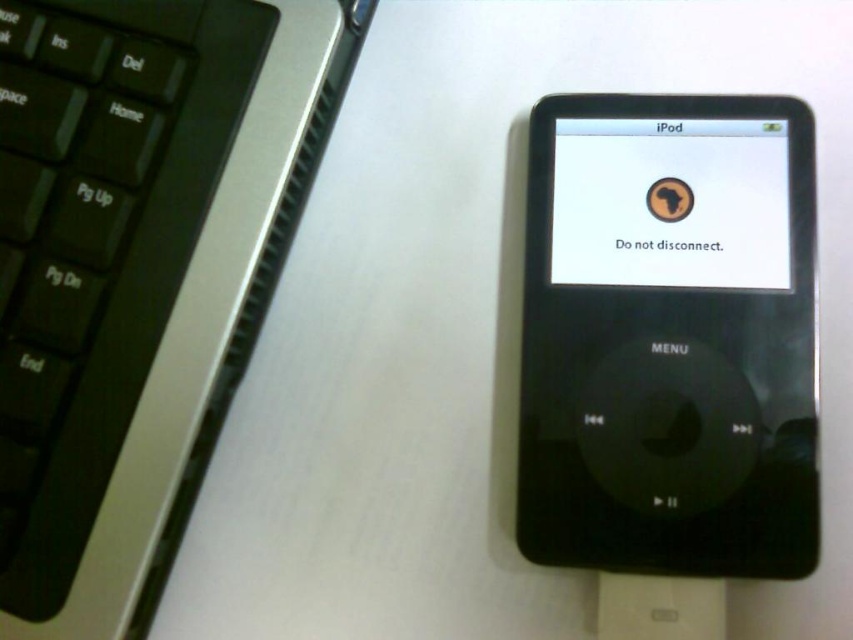
You are setting up a home office and need to place a wireless mouse between the black plastic keyboard at upper left and the black matte ipod at center. Based on their positions, which object should the mouse be closer to?

The black plastic keyboard at upper left is closer to the viewer than the black matte ipod at center, so the mouse should be placed closer to the black plastic keyboard at upper left to maintain a natural workflow.

You are using a black matte ipod at center and need to reach the black plastic keyboard at upper left to type a message. Which direction should you move your hand to reach the keyboard?

The black plastic keyboard at upper left is located to the left of the black matte ipod at center, so you should move your hand to the left to reach it.